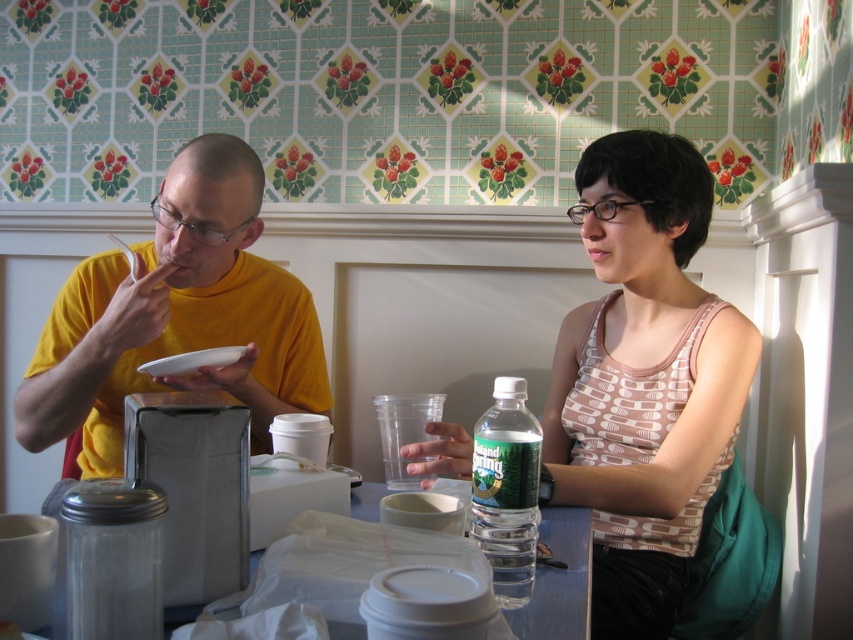
Question: Estimate the real-world distances between objects in this image. Which object is farther from the white matte plate at upper left?

Choices:
 (A) patterned fabric tank top at center
 (B) yellow matte shirt at left
 (C) matte yellow shirt at left
 (D) clear plastic table at lower center

Answer: (A)

Question: Does patterned fabric tank top at center have a smaller size compared to clear plastic water bottle at lower center?

Choices:
 (A) no
 (B) yes

Answer: (A)

Question: Does patterned fabric tank top at center have a lesser width compared to white matte plate at upper left?

Choices:
 (A) yes
 (B) no

Answer: (B)

Question: Which object is closer to the camera taking this photo?

Choices:
 (A) patterned fabric tank top at center
 (B) yellow matte shirt at left

Answer: (A)

Question: Which object is farther from the camera taking this photo?

Choices:
 (A) matte yellow shirt at left
 (B) yellow matte shirt at left

Answer: (B)

Question: Does yellow matte shirt at left appear on the right side of clear plastic table at lower center?

Choices:
 (A) yes
 (B) no

Answer: (B)